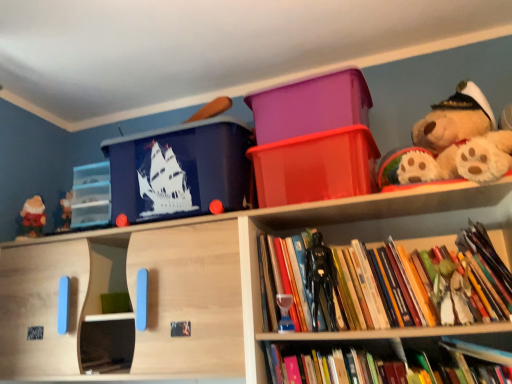
The height and width of the screenshot is (384, 512). What do you see at coordinates (453, 143) in the screenshot?
I see `fluffy beige teddy bear at upper right` at bounding box center [453, 143].

How much space does translucent glass hourglass at center, placed as the 3th toy when sorted from front to back, occupy horizontally?

1.78 inches.

What do you see at coordinates (179, 170) in the screenshot? I see `matte blue plastic storage box at upper left, arranged as the 3th storage box when viewed from the right` at bounding box center [179, 170].

At what (x,y) coordinates should I click in order to perform the action: click on shiny red plastic container at upper center, which is the 4th storage box from left to right. Please return your answer as a coordinate pair (x, y). This screenshot has width=512, height=384. Looking at the image, I should click on (315, 167).

Which is in front, point (97, 211) or point (289, 297)?

Point (289, 297)

In the scene shown: From a real-world perspective, is transparent plastic drawers at left, which is the fourth storage box in right-to-left order, above or below translucent glass hourglass at center, which is the second toy from back to front?

transparent plastic drawers at left, which is the fourth storage box in right-to-left order, is above translucent glass hourglass at center, which is the second toy from back to front.

Is transparent plastic drawers at left, which is the fourth storage box in right-to-left order, positioned beyond the bounds of translucent glass hourglass at center, placed as the 3th toy when sorted from front to back?

Yes, transparent plastic drawers at left, which is the fourth storage box in right-to-left order, is located beyond the bounds of translucent glass hourglass at center, placed as the 3th toy when sorted from front to back.

Does point (509, 159) come closer to viewer compared to point (337, 198)?

Yes, it is.

Where is `storage box that is the 1st object to the left of the fluffy beige teddy bear at upper right, starting at the anchor`? storage box that is the 1st object to the left of the fluffy beige teddy bear at upper right, starting at the anchor is located at coordinates point(315,167).

Considering the positions of objects fluffy beige teddy bear at upper right and shiny red plastic container at upper center, which is the first storage box from right to left, in the image provided, who is behind, fluffy beige teddy bear at upper right or shiny red plastic container at upper center, which is the first storage box from right to left,?

shiny red plastic container at upper center, which is the first storage box from right to left, is further away from the camera.

From a real-world perspective, who is located lower, purple plastic bin at upper center, which is the 2th storage box in right-to-left order, or translucent glass hourglass at center, placed as the 3th toy when sorted from front to back?

In real-world perspective, translucent glass hourglass at center, placed as the 3th toy when sorted from front to back, is lower.

Is purple plastic bin at upper center, the third storage box positioned from the left, beside translucent glass hourglass at center, which is the second toy from back to front?

No, purple plastic bin at upper center, the third storage box positioned from the left, is not beside translucent glass hourglass at center, which is the second toy from back to front.

Considering the sizes of purple plastic bin at upper center, the third storage box positioned from the left, and translucent glass hourglass at center, the third toy viewed from the right, in the image, is purple plastic bin at upper center, the third storage box positioned from the left, wider or thinner than translucent glass hourglass at center, the third toy viewed from the right,?

purple plastic bin at upper center, the third storage box positioned from the left, is wider than translucent glass hourglass at center, the third toy viewed from the right.

Which is more to the left, purple plastic bin at upper center, which is the 2th storage box in right-to-left order, or translucent glass hourglass at center, the third toy viewed from the right?

From the viewer's perspective, translucent glass hourglass at center, the third toy viewed from the right, appears more on the left side.

Is the position of black plastic action figure at center, the second toy positioned from the front, less distant than that of shiny red plastic container at upper center, which is the 4th storage box from left to right?

Yes, black plastic action figure at center, the second toy positioned from the front, is closer to the viewer.

Is black plastic action figure at center, the third toy positioned from the back, smaller than shiny red plastic container at upper center, which is the 4th storage box from left to right?

Yes, black plastic action figure at center, the third toy positioned from the back, is smaller than shiny red plastic container at upper center, which is the 4th storage box from left to right.

Is black plastic action figure at center, which ranks as the second toy in right-to-left order, positioned far away from shiny red plastic container at upper center, which is the 4th storage box from left to right?

They are positioned close to each other.

Could you measure the distance between black plastic action figure at center, the third toy positioned from the back, and shiny red plastic container at upper center, which is the first storage box from right to left?

black plastic action figure at center, the third toy positioned from the back, is 9.70 inches away from shiny red plastic container at upper center, which is the first storage box from right to left.

Can you confirm if translucent glass hourglass at center, which is the second toy from back to front, is thinner than fluffy beige teddy bear at upper right?

Indeed, translucent glass hourglass at center, which is the second toy from back to front, has a lesser width compared to fluffy beige teddy bear at upper right.

Is translucent glass hourglass at center, the third toy viewed from the right, turned away from fluffy beige teddy bear at upper right?

No.

Is translucent glass hourglass at center, the third toy viewed from the right, not within fluffy beige teddy bear at upper right?

translucent glass hourglass at center, the third toy viewed from the right, is positioned outside fluffy beige teddy bear at upper right.

From the image's perspective, is translucent glass hourglass at center, the third toy viewed from the right, located beneath purple plastic bin at upper center, which is the 2th storage box in right-to-left order?

Yes, from the image's perspective, translucent glass hourglass at center, the third toy viewed from the right, is beneath purple plastic bin at upper center, which is the 2th storage box in right-to-left order.

Which is behind, point (290, 306) or point (344, 77)?

The point (344, 77) is farther from the camera.

The width and height of the screenshot is (512, 384). What are the coordinates of `the 1st toy in front of the purple plastic bin at upper center, the third storage box positioned from the left` in the screenshot? It's located at (285, 313).

How different are the orientations of shiny red plastic container at upper center, which is the 4th storage box from left to right, and translucent glass hourglass at center, placed as the 3th toy when sorted from front to back, in degrees?

They differ by 2.44 degrees in their facing directions.

This screenshot has width=512, height=384. Find the location of `storage box that is the 3rd object located above the translucent glass hourglass at center, positioned as the second toy in left-to-right order (from the image's perspective)`. storage box that is the 3rd object located above the translucent glass hourglass at center, positioned as the second toy in left-to-right order (from the image's perspective) is located at coordinates (315, 167).

From the image's perspective, is shiny red plastic container at upper center, which is the first storage box from right to left, located above translucent glass hourglass at center, positioned as the second toy in left-to-right order?

Indeed, from the image's perspective, shiny red plastic container at upper center, which is the first storage box from right to left, is shown above translucent glass hourglass at center, positioned as the second toy in left-to-right order.

Are shiny red plastic container at upper center, which is the first storage box from right to left, and translucent glass hourglass at center, placed as the 3th toy when sorted from front to back, making contact?

shiny red plastic container at upper center, which is the first storage box from right to left, is not next to translucent glass hourglass at center, placed as the 3th toy when sorted from front to back, and they're not touching.

Which storage box is the 3rd one when counting from the back of the translucent glass hourglass at center, the third toy viewed from the right? Please provide its 2D coordinates.

[(91, 195)]

From a real-world perspective, count 3rd storage boxs downward from the fluffy beige teddy bear at upper right and point to it. Please provide its 2D coordinates.

[(315, 167)]

When comparing their distances from purple plastic bin at upper center, which is the 2th storage box in right-to-left order, does translucent glass hourglass at center, which is the second toy from back to front, or shiny red plastic container at upper center, which is the 4th storage box from left to right, seem further?

→ translucent glass hourglass at center, which is the second toy from back to front, lies further to purple plastic bin at upper center, which is the 2th storage box in right-to-left order, than the other object.

Estimate the real-world distances between objects in this image. Which object is closer to shiny red plastic container at upper center, which is the first storage box from right to left, wooden doll at lower right, placed as the fourth toy when sorted from left to right, or hardcover book at lower center, which is the second book in top-to-bottom order?

wooden doll at lower right, placed as the fourth toy when sorted from left to right, lies closer to shiny red plastic container at upper center, which is the first storage box from right to left, than the other object.

Looking at this image, based on their spatial positions, is matte blue plastic storage box at upper left, marked as the 2th storage box in a left-to-right arrangement, or transparent plastic drawers at left, which is the fourth storage box in right-to-left order, further from translucent glass hourglass at center, which is the second toy from back to front?

The object further to translucent glass hourglass at center, which is the second toy from back to front, is transparent plastic drawers at left, which is the fourth storage box in right-to-left order.

When comparing their distances from fluffy beige teddy bear at upper right, does matte blue plastic storage box at upper left, arranged as the 3th storage box when viewed from the right, or hardcover books at center, the first book from the top, seem further?

matte blue plastic storage box at upper left, arranged as the 3th storage box when viewed from the right, is further to fluffy beige teddy bear at upper right.

When comparing their distances from translucent glass hourglass at center, which is the second toy from back to front, does wooden doll at lower right, which is the first toy from right to left, or purple plastic bin at upper center, the third storage box positioned from the left, seem closer?

wooden doll at lower right, which is the first toy from right to left.

From the image, which object appears to be nearer to wooden doll at lower right, placed as the fourth toy when sorted from left to right, translucent glass hourglass at center, positioned as the second toy in left-to-right order, or hardcover book at lower center, the first book positioned from the bottom?

Based on the image, hardcover book at lower center, the first book positioned from the bottom, appears to be nearer to wooden doll at lower right, placed as the fourth toy when sorted from left to right.

Looking at the image, which one is located further to black plastic action figure at center, acting as the 3th toy starting from the left, transparent plastic drawers at left, which ranks as the 1th storage box in left-to-right order, or hardcover books at center, the first book from the top?

transparent plastic drawers at left, which ranks as the 1th storage box in left-to-right order, is positioned further to the anchor black plastic action figure at center, acting as the 3th toy starting from the left.

Based on their spatial positions, is matte red santa at left, which appears as the fourth toy when viewed from the front, or transparent plastic drawers at left, which is the fourth storage box in right-to-left order, closer to wooden doll at lower right, which is the first toy from right to left?

Among the two, transparent plastic drawers at left, which is the fourth storage box in right-to-left order, is located nearer to wooden doll at lower right, which is the first toy from right to left.

Identify the location of book between shiny red plastic container at upper center, which is the 4th storage box from left to right, and translucent glass hourglass at center, which is the second toy from back to front, vertically. (414, 285).

Find the location of a particular element. book between fluffy beige teddy bear at upper right and hardcover book at lower center, which is the second book in top-to-bottom order, vertically is located at coordinates (414, 285).

I want to click on book that lies between purple plastic bin at upper center, which is the 2th storage box in right-to-left order, and translucent glass hourglass at center, positioned as the second toy in left-to-right order, from top to bottom, so click(414, 285).

The width and height of the screenshot is (512, 384). I want to click on toy between translucent glass hourglass at center, which is the second toy from back to front, and hardcover books at center, the first book from the top, so (x=320, y=278).